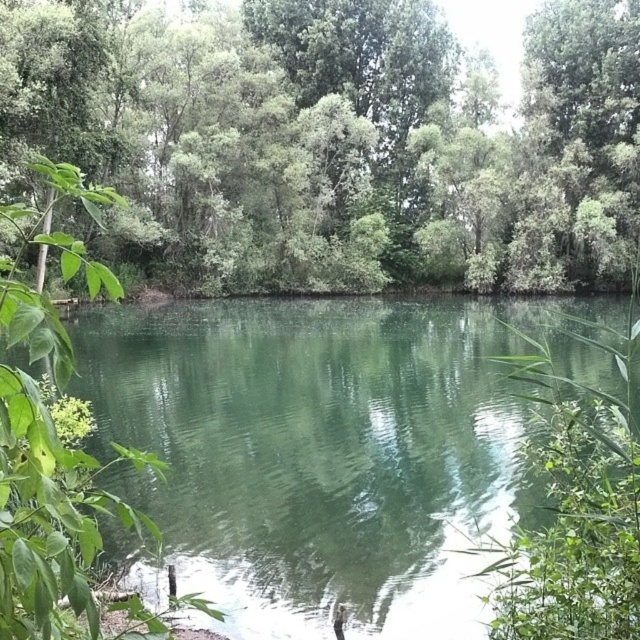
Is green leafy tree at center above green smooth water at center?

Indeed, green leafy tree at center is positioned over green smooth water at center.

Does green leafy tree at center have a larger size compared to green smooth water at center?

Yes, green leafy tree at center is bigger than green smooth water at center.

Between point (401, 253) and point (388, 608), which one is positioned behind?

The point (401, 253) is behind.

Identify the location of green leafy tree at center. (332, 141).